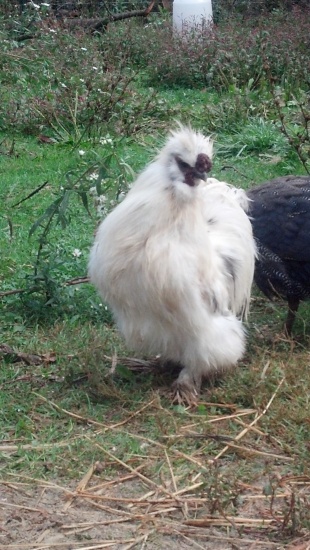
Locate an element on the screen. The image size is (310, 550). plant is located at coordinates (48, 210), (287, 132), (237, 95), (71, 101), (183, 56), (263, 44), (41, 62), (35, 18).